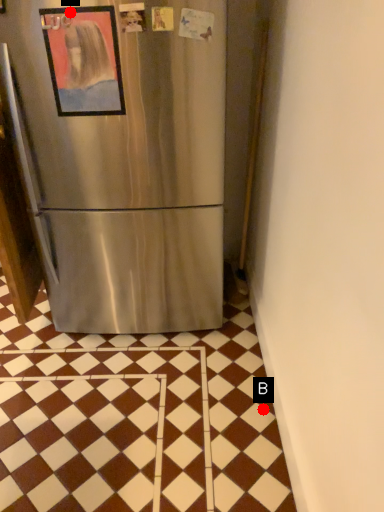
Question: Two points are circled on the image, labeled by A and B beside each circle. Which point appears closest to the camera in this image?

Choices:
 (A) A is closer
 (B) B is closer

Answer: (A)